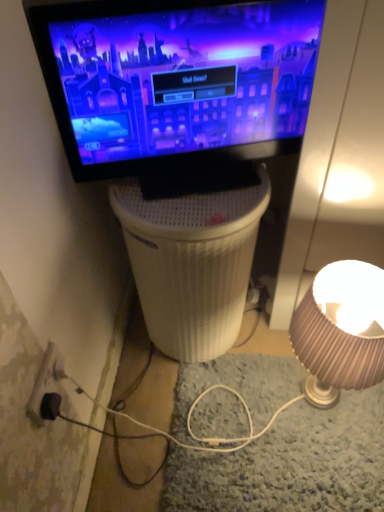
What are the coordinates of `matte beige lampshade at right` in the screenshot? It's located at (340, 331).

The width and height of the screenshot is (384, 512). I want to click on white ribbed plastic at center, so click(x=191, y=263).

Find the location of a particular element. matte black monitor at upper center is located at coordinates (177, 86).

The image size is (384, 512). In order to click on matte beige lampshade at right in this screenshot , I will do [x=340, y=331].

Is point (140, 247) more distant than point (60, 400)?

Yes, it is.

Is white ribbed plastic at center situated inside black plastic power outlet at lower left or outside?

The correct answer is: outside.

What's the angular difference between white ribbed plastic at center and black plastic power outlet at lower left's facing directions?

white ribbed plastic at center and black plastic power outlet at lower left are facing 92.1 degrees away from each other.

Who is more distant, matte black monitor at upper center or black plastic power outlet at lower left?

black plastic power outlet at lower left.

Visually, is matte black monitor at upper center positioned to the left or to the right of black plastic power outlet at lower left?

From the image, it's evident that matte black monitor at upper center is to the right of black plastic power outlet at lower left.

Is matte black monitor at upper center placed right next to black plastic power outlet at lower left?

No, matte black monitor at upper center is not next to black plastic power outlet at lower left.

Which point is more distant from viewer, [107,131] or [59,377]?

Point [107,131]

In terms of height, does matte black monitor at upper center look taller or shorter compared to matte beige lampshade at right?

Clearly, matte black monitor at upper center is shorter compared to matte beige lampshade at right.

Consider the image. From a real-world perspective, who is located higher, matte black monitor at upper center or matte beige lampshade at right?

From a 3D spatial view, matte black monitor at upper center is above.

Is point (284, 17) positioned in front of point (335, 285)?

Yes, it is.

Consider the image. Is matte black monitor at upper center turned away from matte beige lampshade at right?

That's not correct — matte black monitor at upper center is not looking away from matte beige lampshade at right.

Considering the positions of objects black plastic power outlet at lower left and matte black monitor at upper center in the image provided, who is behind, black plastic power outlet at lower left or matte black monitor at upper center?

black plastic power outlet at lower left is further from the camera.

Does point (52, 344) come farther from viewer compared to point (302, 42)?

Yes, it is behind point (302, 42).

Is black plastic power outlet at lower left surrounding matte black monitor at upper center?

Actually, matte black monitor at upper center is outside black plastic power outlet at lower left.

Looking at this image, from a real-world perspective, between black plastic power outlet at lower left and matte black monitor at upper center, who is vertically higher?

In real-world perspective, matte black monitor at upper center is above.

Where is `electric outlet that is below the white ribbed plastic at center (from the image's perspective)`? electric outlet that is below the white ribbed plastic at center (from the image's perspective) is located at coordinates (45, 381).

In the scene shown: Between black plastic power outlet at lower left and white ribbed plastic at center, which one has smaller size?

black plastic power outlet at lower left.

From a real-world perspective, is black plastic power outlet at lower left positioned over white ribbed plastic at center based on gravity?

Yes, from a real-world perspective, black plastic power outlet at lower left is over white ribbed plastic at center

How many degrees apart are the facing directions of white ribbed plastic at center and matte black monitor at upper center?

They differ by 18.6 degrees in their facing directions.

Can you confirm if white ribbed plastic at center is positioned to the right of matte black monitor at upper center?

No.

From the image's perspective, is white ribbed plastic at center over matte black monitor at upper center?

No, from the image's perspective, white ribbed plastic at center is not over matte black monitor at upper center.

Is white ribbed plastic at center located outside matte black monitor at upper center?

Yes, white ribbed plastic at center is not within matte black monitor at upper center.

Considering the sizes of objects white ribbed plastic at center and matte beige lampshade at right in the image provided, who is wider, white ribbed plastic at center or matte beige lampshade at right?

With larger width is white ribbed plastic at center.

Which is correct: white ribbed plastic at center is inside matte beige lampshade at right, or outside of it?

white ribbed plastic at center exists outside the volume of matte beige lampshade at right.

Looking at this image, how much distance is there between white ribbed plastic at center and matte beige lampshade at right?

A distance of 11.78 inches exists between white ribbed plastic at center and matte beige lampshade at right.

From the image's perspective, would you say white ribbed plastic at center is positioned over matte beige lampshade at right?

Yes.

Image resolution: width=384 pixels, height=512 pixels. What are the coordinates of `electric outlet below the white ribbed plastic at center (from the image's perspective)` in the screenshot? It's located at (45, 381).

The image size is (384, 512). What are the coordinates of `television on the right side of black plastic power outlet at lower left` in the screenshot? It's located at (177, 86).

From the image, which object appears to be nearer to black plastic power outlet at lower left, matte beige lampshade at right or white ribbed plastic at center?

white ribbed plastic at center.

Looking at the image, which one is located closer to black plastic power outlet at lower left, matte black monitor at upper center or white ribbed plastic at center?

white ribbed plastic at center lies closer to black plastic power outlet at lower left than the other object.

From the image, which object appears to be nearer to matte beige lampshade at right, matte black monitor at upper center or white ribbed plastic at center?

white ribbed plastic at center lies closer to matte beige lampshade at right than the other object.

Looking at the image, which one is located closer to white ribbed plastic at center, black plastic power outlet at lower left or matte black monitor at upper center?

Based on the image, matte black monitor at upper center appears to be nearer to white ribbed plastic at center.

When comparing their distances from matte black monitor at upper center, does white ribbed plastic at center or matte beige lampshade at right seem further?

The object further to matte black monitor at upper center is matte beige lampshade at right.

In the scene shown: From the image, which object appears to be farther from matte black monitor at upper center, matte beige lampshade at right or white ribbed plastic at center?

matte beige lampshade at right.

Which object lies nearer to the anchor point black plastic power outlet at lower left, white ribbed plastic at center or matte black monitor at upper center?

white ribbed plastic at center.

Consider the image. Based on their spatial positions, is matte beige lampshade at right or black plastic power outlet at lower left closer to matte black monitor at upper center?

matte beige lampshade at right is positioned closer to the anchor matte black monitor at upper center.

You are a GUI agent. You are given a task and a screenshot of the screen. Output one action in this format:
    pyautogui.click(x=<x>, y=<y>)
    Task: Click on the table that lies between matte black monitor at upper center and matte beige lampshade at right from top to bottom
    The image size is (384, 512).
    Given the screenshot: What is the action you would take?
    pyautogui.click(x=191, y=263)

Where is `table between matte black monitor at upper center and black plastic power outlet at lower left from top to bottom`? table between matte black monitor at upper center and black plastic power outlet at lower left from top to bottom is located at coordinates (191, 263).

Locate an element on the screen. lamp that lies between matte black monitor at upper center and black plastic power outlet at lower left from top to bottom is located at coordinates (340, 331).

Identify the location of table situated between black plastic power outlet at lower left and matte beige lampshade at right from left to right. (191, 263).